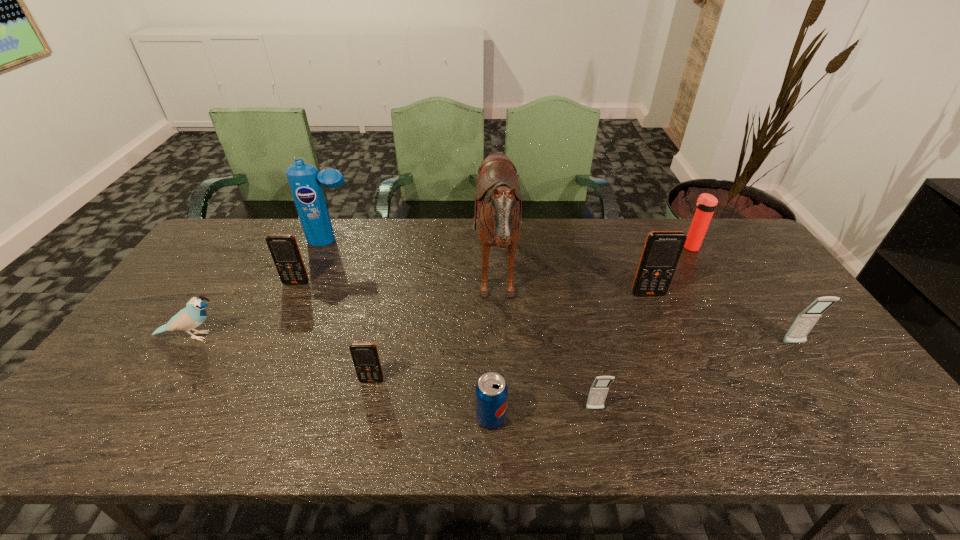
The width and height of the screenshot is (960, 540). Find the location of `thermos bottle that is at the far edge`. thermos bottle that is at the far edge is located at coordinates (706, 203).

Identify the location of cellular telephone located in the near edge section of the desktop. The height and width of the screenshot is (540, 960). (599, 389).

This screenshot has height=540, width=960. In order to click on pop soda that is at the near edge in this screenshot , I will do `click(491, 392)`.

The height and width of the screenshot is (540, 960). Identify the location of object at the left edge. (194, 314).

This screenshot has height=540, width=960. Identify the location of object that is at the right edge. (805, 321).

Image resolution: width=960 pixels, height=540 pixels. I want to click on vacant area at the far edge of the desktop, so click(420, 240).

This screenshot has width=960, height=540. I want to click on free space at the near edge, so click(785, 431).

The height and width of the screenshot is (540, 960). In the image, there is a desktop. Identify the location of vacant space at the right edge. (783, 362).

In the image, there is a desktop. Where is `vacant space at the far left corner`? vacant space at the far left corner is located at coordinates (256, 242).

You are a GUI agent. You are given a task and a screenshot of the screen. Output one action in this format:
    pyautogui.click(x=<x>, y=<y>)
    Task: Click on the free space at the near left corner of the desktop
    
    Given the screenshot: What is the action you would take?
    pyautogui.click(x=51, y=443)